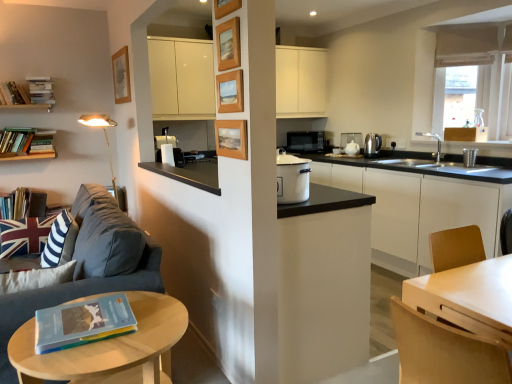
Question: From the image's perspective, would you say hardcover book at left, which is the fifth book in top-to-bottom order, is positioned over hardcover books at upper left, which is counted as the third book, starting from the right?

Choices:
 (A) yes
 (B) no

Answer: (B)

Question: Is hardcover book at left, which is the fifth book in top-to-bottom order, located outside hardcover books at upper left, arranged as the sixth book when ordered from the bottom?

Choices:
 (A) no
 (B) yes

Answer: (B)

Question: Is hardcover book at left, which appears as the fourth book when viewed from the back, closer to the viewer compared to hardcover books at upper left, arranged as the sixth book when ordered from the bottom?

Choices:
 (A) yes
 (B) no

Answer: (A)

Question: Is hardcover book at left, the fifth book viewed from the right, facing away from hardcover books at upper left, which is counted as the third book, starting from the right?

Choices:
 (A) no
 (B) yes

Answer: (A)

Question: Is hardcover book at left, which ranks as the second book in left-to-right order, not near hardcover books at upper left, the 5th book positioned from the front?

Choices:
 (A) no
 (B) yes

Answer: (B)

Question: Considering their positions, is hardcover book at lower left, the sixth book viewed from the top, located in front of or behind black matte counter top at center?

Choices:
 (A) front
 (B) behind

Answer: (A)

Question: Is hardcover book at lower left, the first book when ordered from front to back, taller or shorter than black matte counter top at center?

Choices:
 (A) short
 (B) tall

Answer: (A)

Question: Would you say hardcover book at lower left, arranged as the 1th book when viewed from the right, is to the left or to the right of black matte counter top at center in the picture?

Choices:
 (A) right
 (B) left

Answer: (B)

Question: From the image's perspective, relative to black matte counter top at center, is hardcover book at lower left, arranged as the 1th book when viewed from the right, above or below?

Choices:
 (A) below
 (B) above

Answer: (A)

Question: Is white matte cabinet at center bigger or smaller than hardcover book at lower left, the first book when ordered from front to back?

Choices:
 (A) small
 (B) big

Answer: (B)

Question: Is white matte cabinet at center taller or shorter than hardcover book at lower left, the first book when ordered from front to back?

Choices:
 (A) short
 (B) tall

Answer: (B)

Question: From the image's perspective, is white matte cabinet at center positioned above or below hardcover book at lower left, arranged as the 1th book when viewed from the right?

Choices:
 (A) below
 (B) above

Answer: (B)

Question: From a real-world perspective, is white matte cabinet at center positioned above or below hardcover book at lower left, arranged as the 1th book when viewed from the right?

Choices:
 (A) above
 (B) below

Answer: (B)

Question: From the image's perspective, is hardcover book at left, which ranks as the second book in front-to-back order, above or below hardcover book at lower left, which is counted as the sixth book, starting from the left?

Choices:
 (A) above
 (B) below

Answer: (A)

Question: Visually, is hardcover book at left, which is the second book from top to bottom, positioned to the left or to the right of hardcover book at lower left, the 1th book from the bottom?

Choices:
 (A) right
 (B) left

Answer: (B)